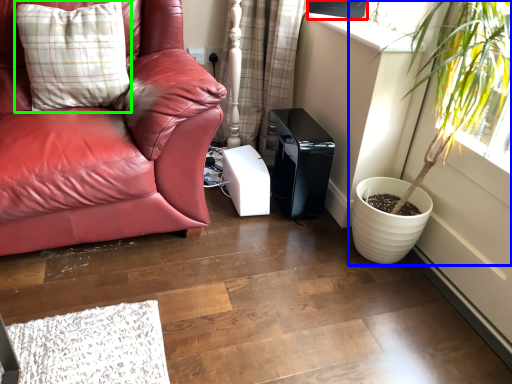
Question: Considering the real-world distances, which object is farthest from window screen (highlighted by a red box)? houseplant (highlighted by a blue box) or pillow (highlighted by a green box)?

Choices:
 (A) houseplant
 (B) pillow

Answer: (B)